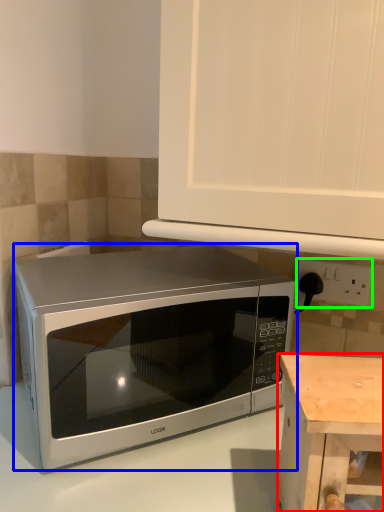
Question: Based on their relative distances, which object is nearer to table (highlighted by a red box)? Choose from microwave oven (highlighted by a blue box) and electric outlet (highlighted by a green box).

Choices:
 (A) microwave oven
 (B) electric outlet

Answer: (A)